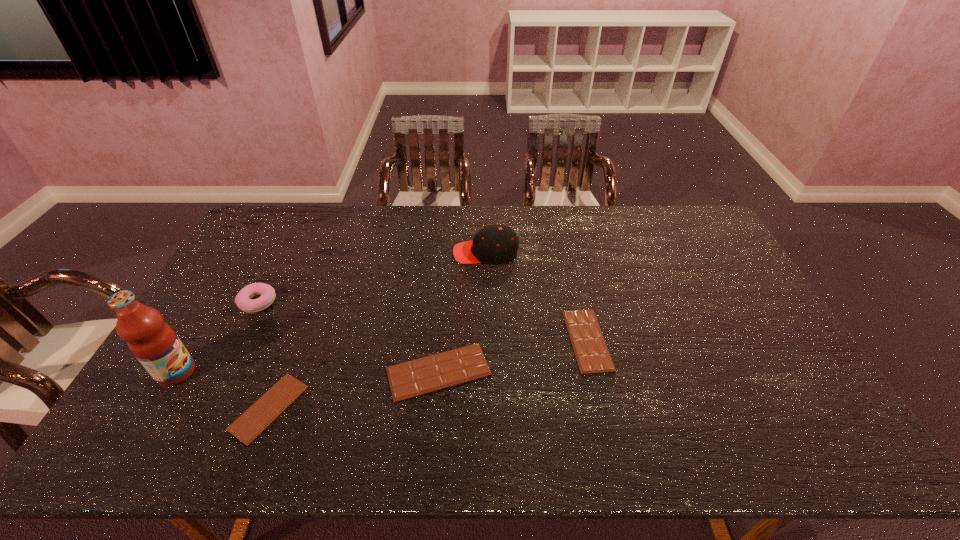
Where is `the second closest chocolate bar to the pastry`? The image size is (960, 540). the second closest chocolate bar to the pastry is located at coordinates (432, 373).

This screenshot has height=540, width=960. What are the coordinates of `chocolate bar object that ranks as the closest to the leftmost object` in the screenshot? It's located at (247, 427).

The image size is (960, 540). I want to click on free space that satisfies the following two spatial constraints: 1. on the front-facing side of the rightmost chocolate bar; 2. on the right side of the cap, so click(x=487, y=340).

Locate an element on the screen. The width and height of the screenshot is (960, 540). free location that satisfies the following two spatial constraints: 1. on the front label of the fourth object from right to left; 2. on the right side of the tallest object is located at coordinates coord(156,408).

Where is `free space that satisfies the following two spatial constraints: 1. on the front label of the leftmost chocolate bar; 2. on the right side of the fruit juice`? The width and height of the screenshot is (960, 540). free space that satisfies the following two spatial constraints: 1. on the front label of the leftmost chocolate bar; 2. on the right side of the fruit juice is located at coordinates (156, 408).